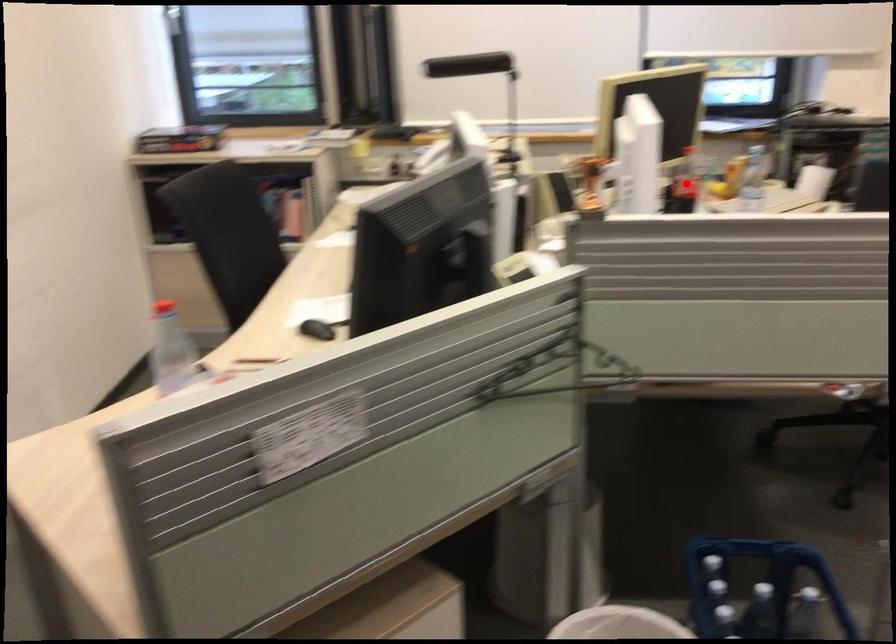
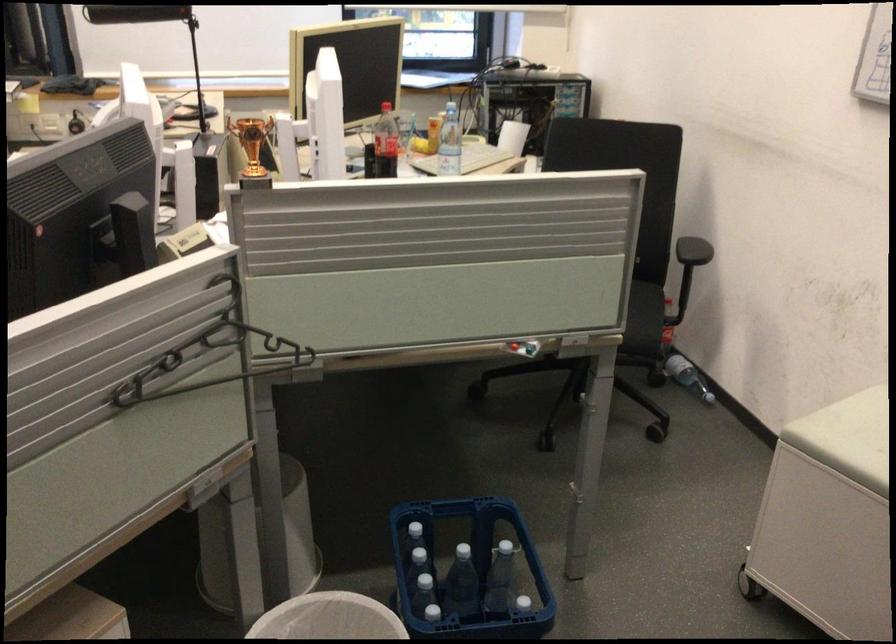
Locate, in the second image, the point that corresponds to the highlighted location in the first image.

(385, 143)